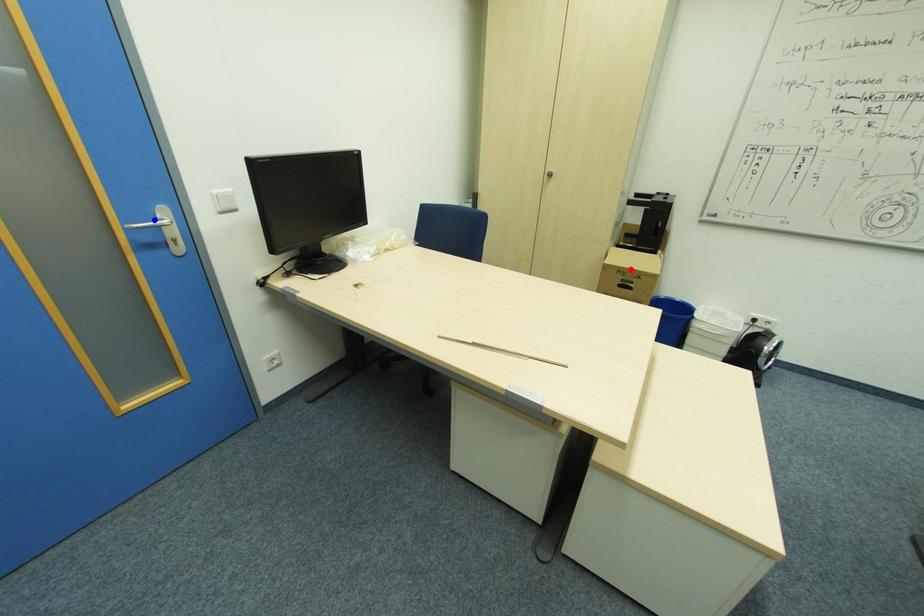
Question: Which of the two points in the image is closer to the camera?

Choices:
 (A) Blue point is closer.
 (B) Red point is closer.

Answer: (A)